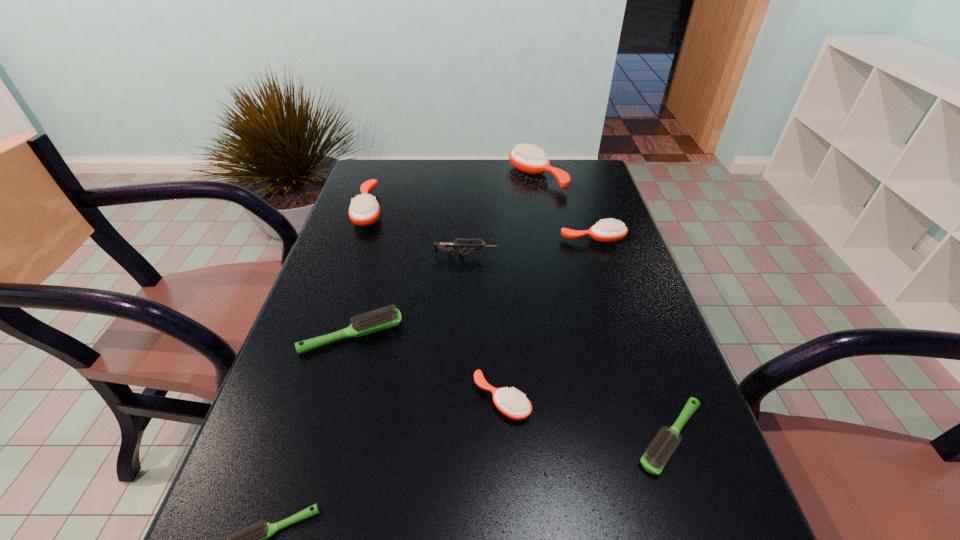
At what (x,y) coordinates should I click in order to perform the action: click on the biggest orange hairbrush. Please return your answer as a coordinate pair (x, y). Looking at the image, I should click on (528, 159).

Find the location of a particular element. the tallest hairbrush is located at coordinates (528, 159).

Find the location of a particular element. The width and height of the screenshot is (960, 540). the sixth shortest hairbrush is located at coordinates (364, 210).

This screenshot has height=540, width=960. In order to click on the leftmost orange hairbrush in this screenshot , I will do `click(364, 210)`.

This screenshot has width=960, height=540. Identify the location of grey gun. (438, 246).

At what (x,y) coordinates should I click in order to perform the action: click on gun. Please return your answer as a coordinate pair (x, y). Looking at the image, I should click on (438, 246).

Find the location of `the third tallest hairbrush`. the third tallest hairbrush is located at coordinates (607, 230).

The width and height of the screenshot is (960, 540). In order to click on the farthest light hairbrush in this screenshot , I will do `click(384, 318)`.

Where is `the biggest light hairbrush`? The image size is (960, 540). the biggest light hairbrush is located at coordinates (384, 318).

You are a GUI agent. You are given a task and a screenshot of the screen. Output one action in this format:
    pyautogui.click(x=<x>, y=<y>)
    Task: Click on the second orange hairbrush from left to right
    The width and height of the screenshot is (960, 540).
    Given the screenshot: What is the action you would take?
    pyautogui.click(x=510, y=402)